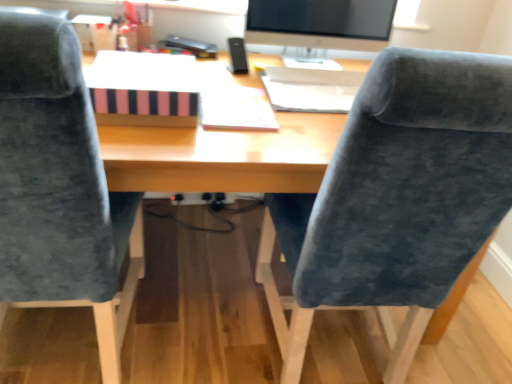
This screenshot has width=512, height=384. Identify the location of free space in front of black plastic remote at center. (239, 76).